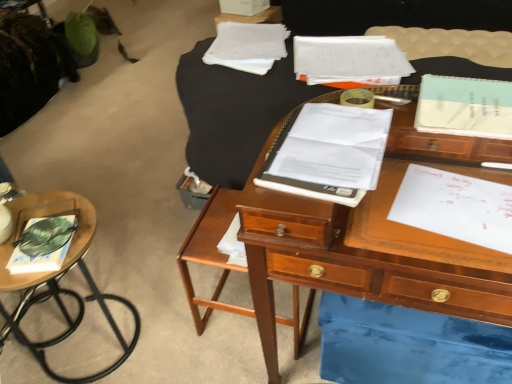
Find the location of `free space to the back side of hardcover book at left`. free space to the back side of hardcover book at left is located at coordinates click(56, 211).